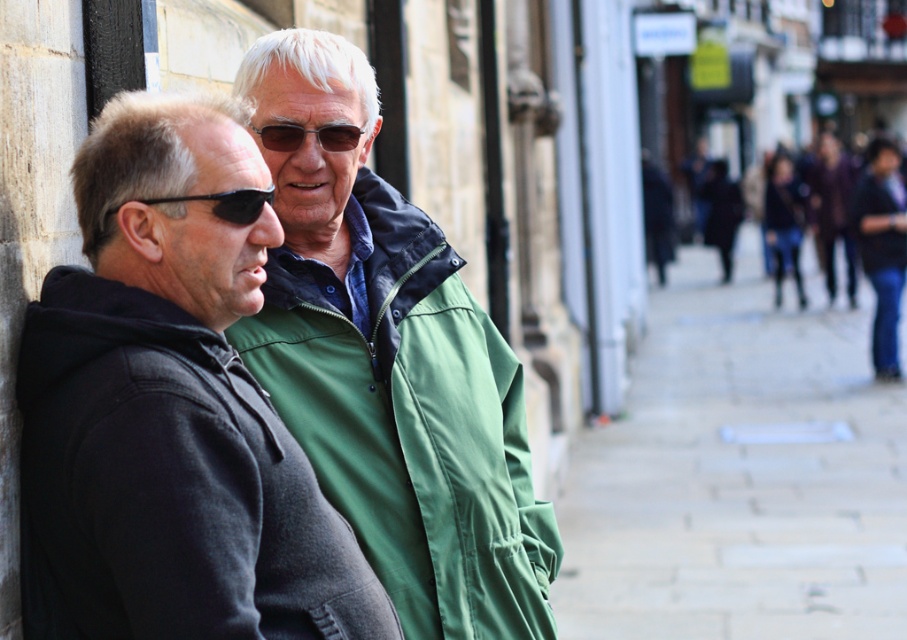
Question: Which object appears farthest from the camera in this image?

Choices:
 (A) matte black hoodie at left
 (B) black fleece jacket at left
 (C) paved stone sidewalk at center
 (D) green fabric jacket at center

Answer: (C)

Question: Does matte black hoodie at left have a greater width compared to green fabric jacket at center?

Choices:
 (A) no
 (B) yes

Answer: (B)

Question: Which point is closer to the camera taking this photo?

Choices:
 (A) (239, 202)
 (B) (861, 528)
 (C) (320, 438)

Answer: (A)

Question: Does matte black hoodie at left appear under denim jacket at right?

Choices:
 (A) no
 (B) yes

Answer: (B)

Question: Estimate the real-world distances between objects in this image. Which object is closer to the matte black sunglasses at center?

Choices:
 (A) matte black hoodie at left
 (B) jeans at right

Answer: (A)

Question: Is paved stone sidewalk at center thinner than green fabric jacket at center?

Choices:
 (A) no
 (B) yes

Answer: (A)